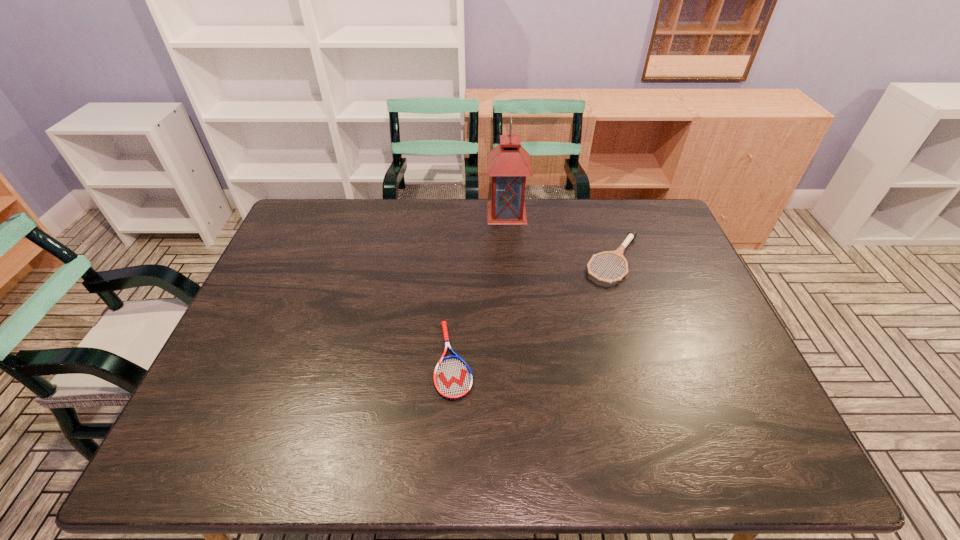
At what (x,y) coordinates should I click in order to perform the action: click on the farthest object. Please return your answer as a coordinate pair (x, y). Looking at the image, I should click on (508, 163).

Where is `the tallest object`? This screenshot has height=540, width=960. the tallest object is located at coordinates (508, 163).

The image size is (960, 540). I want to click on the rightmost object, so click(632, 234).

At what (x,y) coordinates should I click in order to perform the action: click on the second shortest object. Please return your answer as a coordinate pair (x, y). Looking at the image, I should click on (632, 234).

Locate an element on the screen. the left tennis racket is located at coordinates (453, 380).

In order to click on the nearer tennis racket in this screenshot , I will do `click(453, 380)`.

Image resolution: width=960 pixels, height=540 pixels. Find the location of `vacant space situated 0.180m on the front of the lantern`. vacant space situated 0.180m on the front of the lantern is located at coordinates (510, 260).

You are a GUI agent. You are given a task and a screenshot of the screen. Output one action in this format:
    pyautogui.click(x=<x>, y=<y>)
    Task: Click on the vacant region located on the left of the second shortest object
    The height and width of the screenshot is (540, 960).
    Given the screenshot: What is the action you would take?
    pyautogui.click(x=529, y=260)

Locate an element on the screen. vacant area situated 0.380m on the right of the nearer tennis racket is located at coordinates (623, 360).

At what (x,y) coordinates should I click in order to perform the action: click on lantern at the far edge. Please return your answer as a coordinate pair (x, y). This screenshot has width=960, height=540. Looking at the image, I should click on (508, 163).